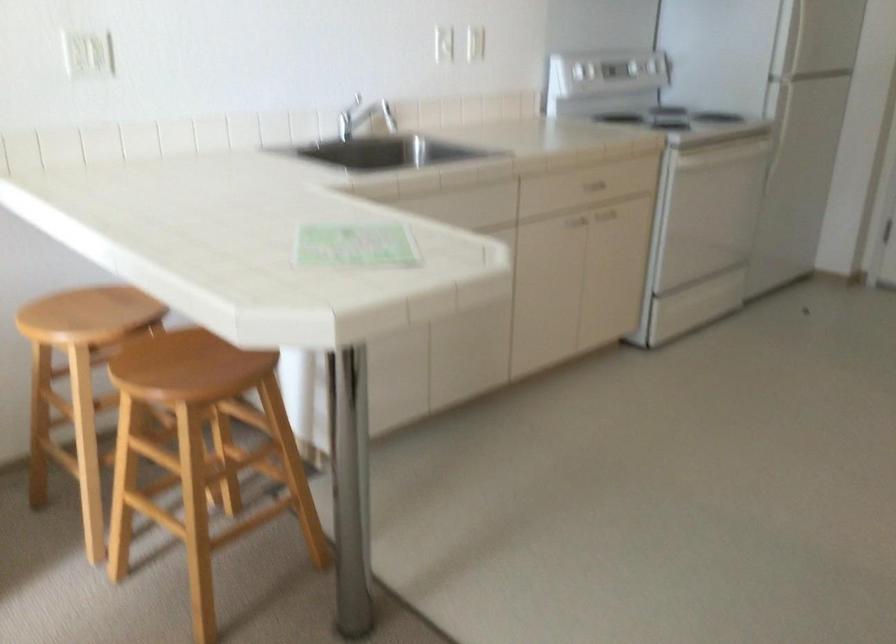
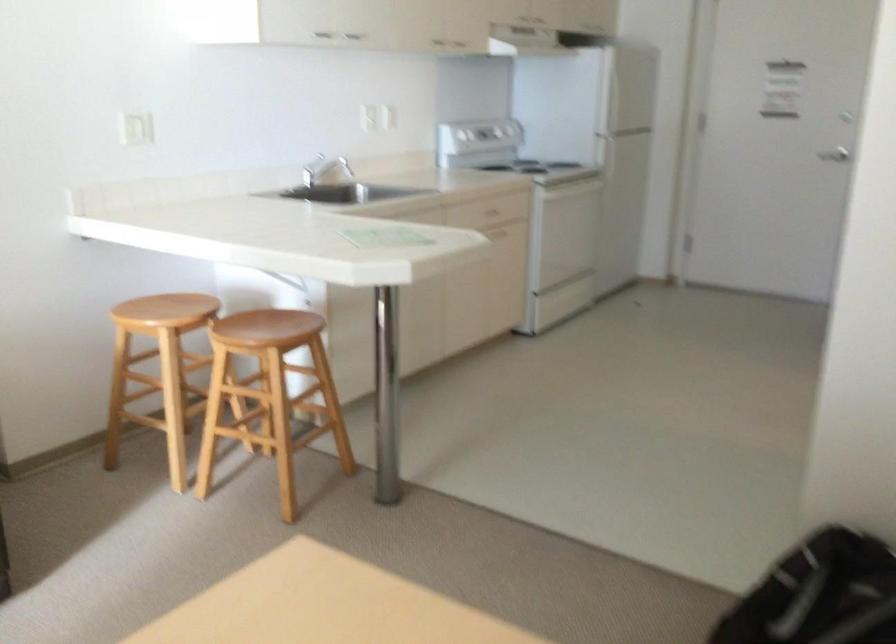
Find the pixel in the second image that matches pixel 191 366 in the first image.

(268, 327)